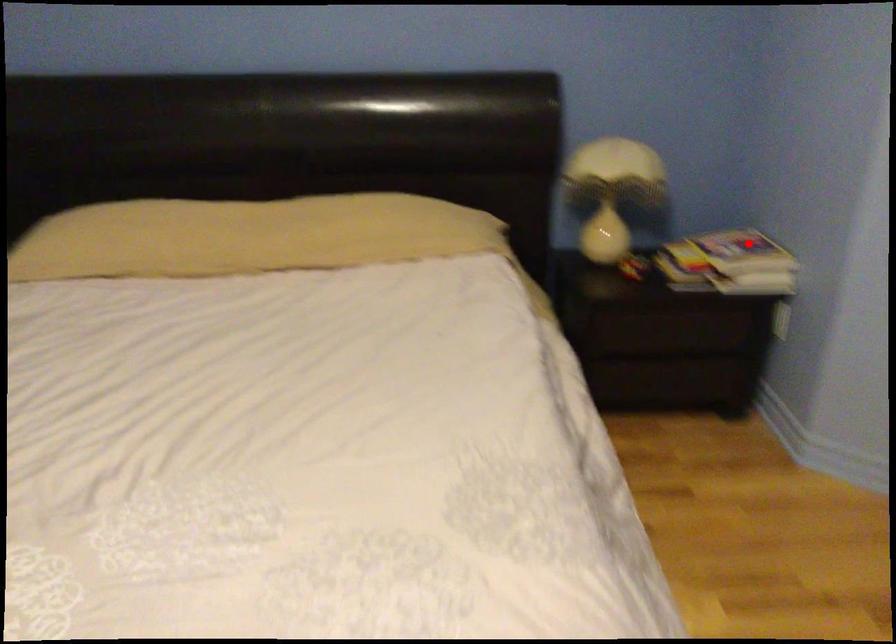
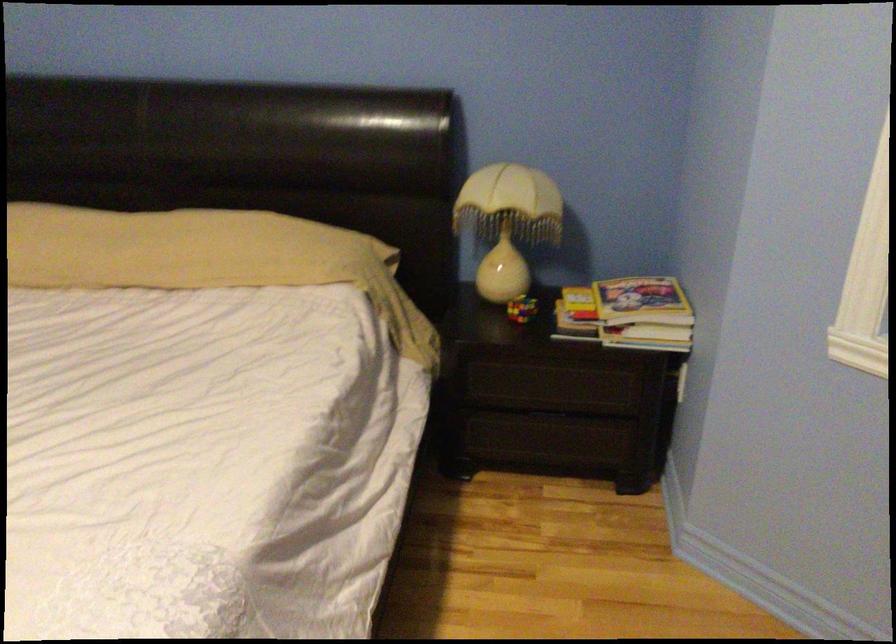
Find the pixel in the second image that matches the highlighted location in the first image.

(642, 301)